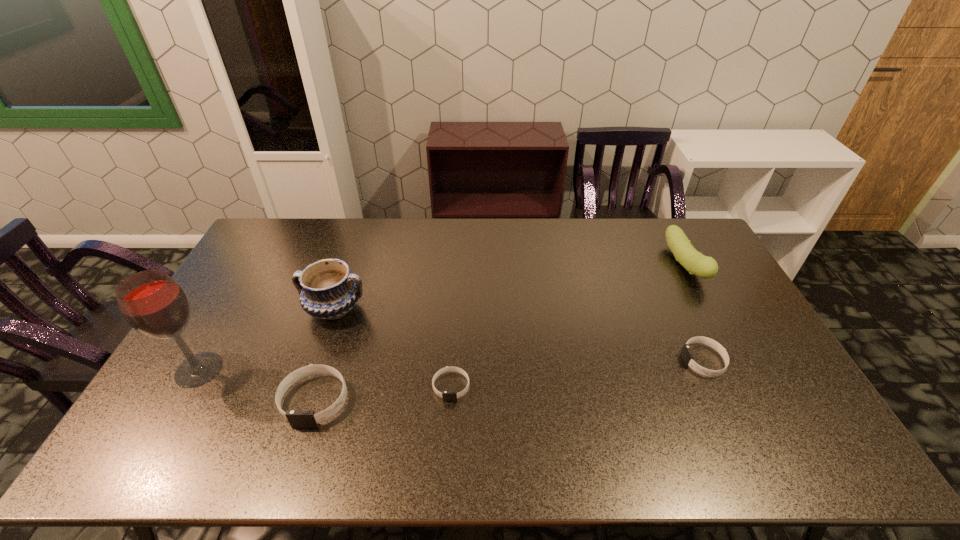
Locate which wristband is the closest to the second shortest object. Please provide its 2D coordinates. Your answer should be formatted as a tuple, i.e. [(x, y)], where the tuple contains the x and y coordinates of a point satisfying the conditions above.

[(446, 395)]

The image size is (960, 540). What are the coordinates of `free location that satisfies the following two spatial constraints: 1. on the outer surface of the rightmost wristband; 2. on the front side of the alcohol` in the screenshot? It's located at (708, 369).

Find the location of a particular element. This screenshot has width=960, height=540. free spot that satisfies the following two spatial constraints: 1. on the front side of the third tallest object; 2. on the outer surface of the second shortest wristband is located at coordinates (736, 361).